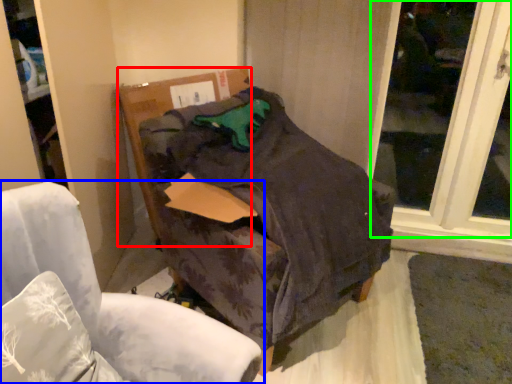
Question: Estimate the real-world distances between objects in this image. Which object is farther from cardboard box (highlighted by a red box), chair (highlighted by a blue box) or window (highlighted by a green box)?

Choices:
 (A) chair
 (B) window

Answer: (B)